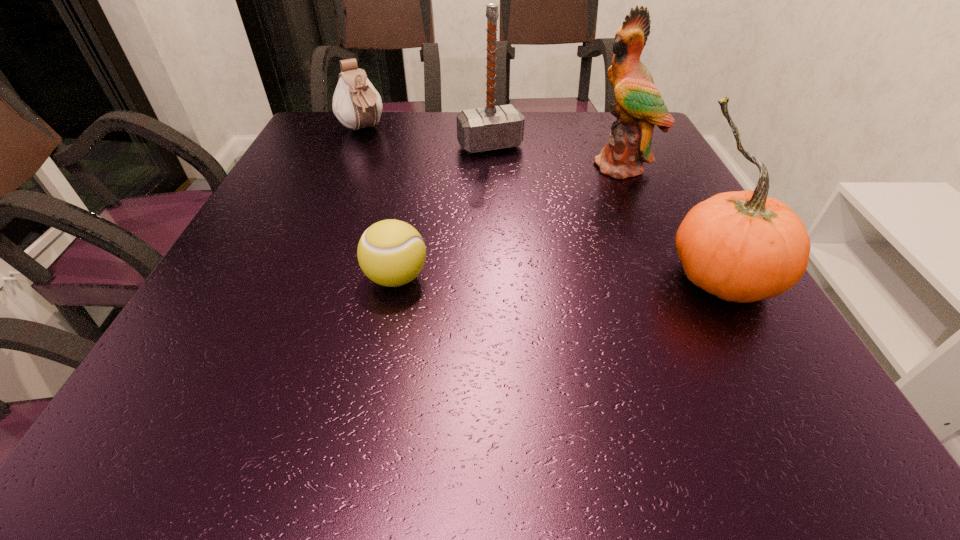
Locate an element on the screen. the shortest object is located at coordinates (391, 253).

The image size is (960, 540). Identify the location of tennis ball. (391, 253).

Where is `pumpkin`? This screenshot has width=960, height=540. pumpkin is located at coordinates (741, 246).

The image size is (960, 540). In order to click on the third object from left to right in this screenshot , I will do `click(493, 127)`.

Where is `parrot`? parrot is located at coordinates (638, 107).

I want to click on the leftmost object, so click(x=356, y=103).

The image size is (960, 540). I want to click on pouch, so click(356, 103).

Find the location of a particular element. The height and width of the screenshot is (540, 960). vacant area situated 0.210m on the left of the second object from left to right is located at coordinates (250, 278).

Locate an element on the screen. This screenshot has width=960, height=540. vacant space positioned 0.350m on the left of the pumpkin is located at coordinates (475, 278).

Locate an element on the screen. Image resolution: width=960 pixels, height=540 pixels. vacant position located on the striking surface of the hammer is located at coordinates 543,224.